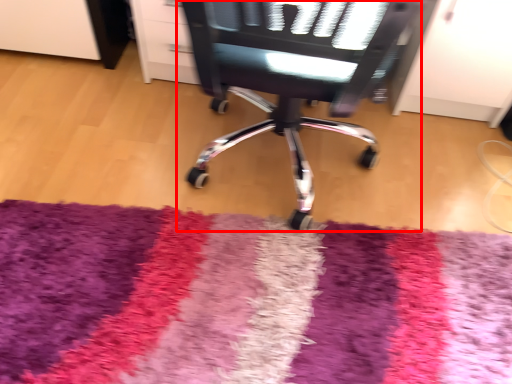
Question: Observing the image, what is the correct spatial positioning of chair (annotated by the red box) in reference to mat?

Choices:
 (A) left
 (B) right

Answer: (B)